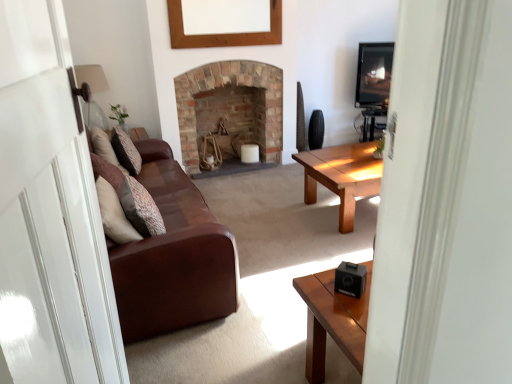
Question: Is matte glass lampshade at upper left to the left or to the right of black plastic speaker at lower right in the image?

Choices:
 (A) left
 (B) right

Answer: (A)

Question: Does point (84, 114) appear closer or farther from the camera than point (339, 271)?

Choices:
 (A) closer
 (B) farther

Answer: (B)

Question: Estimate the real-world distances between objects in this image. Which object is farther from the transparent glass door at left?

Choices:
 (A) black plastic speaker at lower right
 (B) matte glass lampshade at upper left
 (C) brown leather couch at left
 (D) brick fireplace at center
 (E) patterned fabric pillow at left, marked as the 2th pillow in a left-to-right arrangement

Answer: (D)

Question: Based on their relative distances, which object is nearer to the wooden picture frame at upper center?

Choices:
 (A) patterned fabric pillow at left, placed as the second pillow when sorted from right to left
 (B) brown leather couch at left
 (C) brick fireplace at center
 (D) patterned fabric pillow at left, the second pillow when ordered from top to bottom
 (E) transparent glass door at left

Answer: (C)